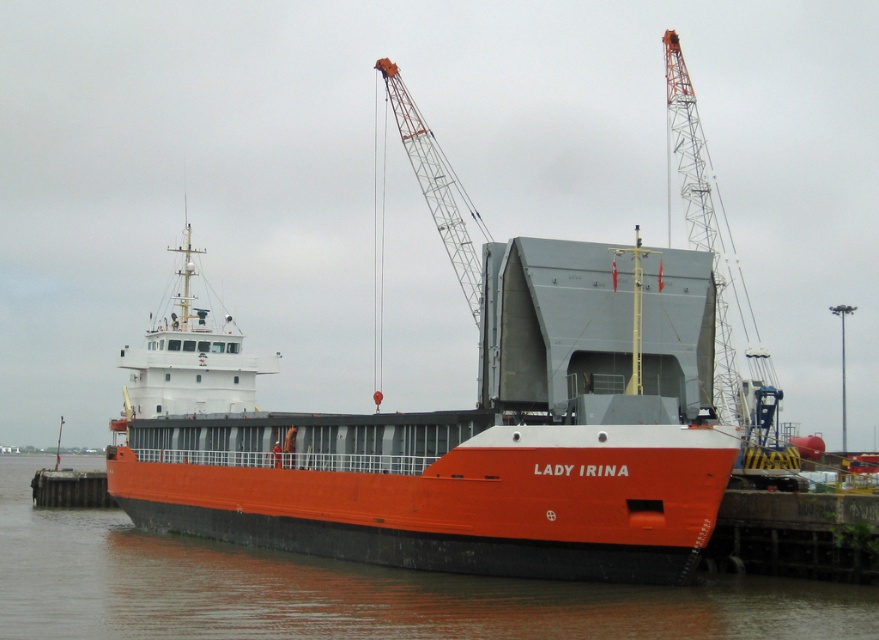
Is orange matte cargo ship at center below metallic gray crane at upper right?

Indeed, orange matte cargo ship at center is positioned under metallic gray crane at upper right.

Who is more distant from viewer, (554, 531) or (768, 426)?

Positioned behind is point (768, 426).

Image resolution: width=879 pixels, height=640 pixels. I want to click on orange matte cargo ship at center, so click(466, 435).

Identify the location of orange matte cargo ship at center. The height and width of the screenshot is (640, 879). (466, 435).

Is point (158, 570) less distant than point (410, 152)?

Yes, it is in front of point (410, 152).

Does point (260, 552) come farther from viewer compared to point (489, 241)?

Yes, it is behind point (489, 241).

The width and height of the screenshot is (879, 640). I want to click on orange matte water at lower center, so click(351, 589).

Looking at this image, is orange matte cargo ship at center to the left of metallic gray crane at upper center from the viewer's perspective?

Indeed, orange matte cargo ship at center is positioned on the left side of metallic gray crane at upper center.

Who is higher up, orange matte cargo ship at center or metallic gray crane at upper center?

Positioned higher is metallic gray crane at upper center.

Who is more distant from viewer, (352, 506) or (449, 202)?

The point (449, 202) is behind.

Find the location of a particular element. orange matte cargo ship at center is located at coordinates (466, 435).